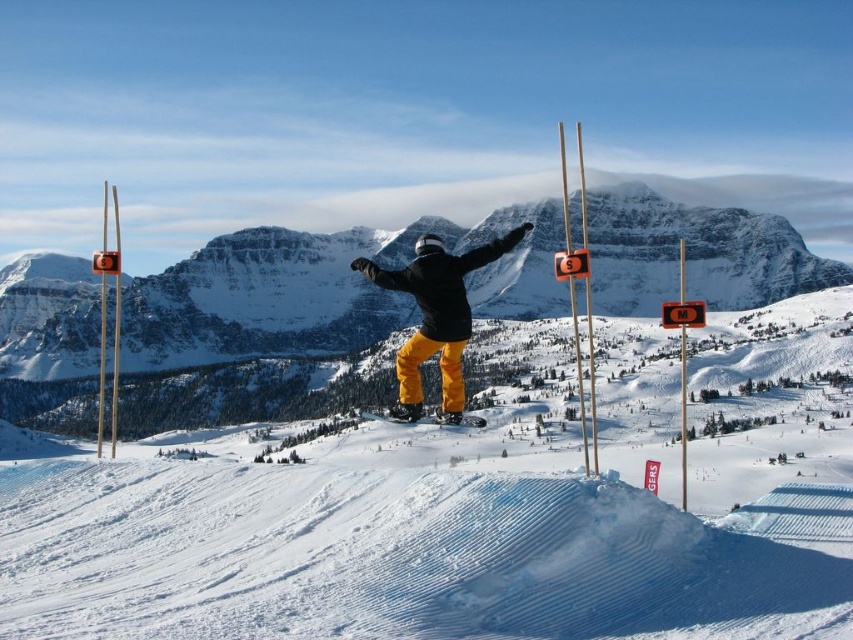
Question: Among these objects, which one is nearest to the camera?

Choices:
 (A) matte yellow snowboard at center
 (B) matte black snowboarder at center

Answer: (B)

Question: Which point appears closest to the camera in this image?

Choices:
 (A) (426, 298)
 (B) (241, 442)
 (C) (386, 416)

Answer: (A)

Question: Which object appears closest to the camera in this image?

Choices:
 (A) matte yellow snowboard at center
 (B) matte black snowboarder at center
 (C) white powdery snow at center

Answer: (C)

Question: Considering the relative positions of white powdery snow at center and matte black snowboarder at center in the image provided, where is white powdery snow at center located with respect to matte black snowboarder at center?

Choices:
 (A) right
 (B) left

Answer: (A)

Question: In this image, where is white powdery snow at center located relative to matte yellow snowboard at center?

Choices:
 (A) left
 (B) right

Answer: (B)

Question: Is matte black snowboarder at center above matte yellow snowboard at center?

Choices:
 (A) yes
 (B) no

Answer: (A)